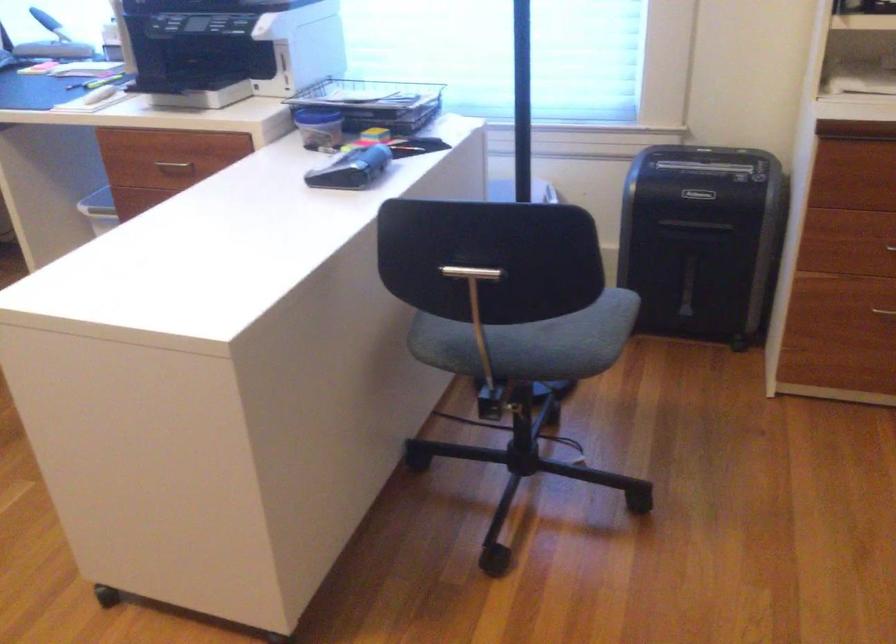
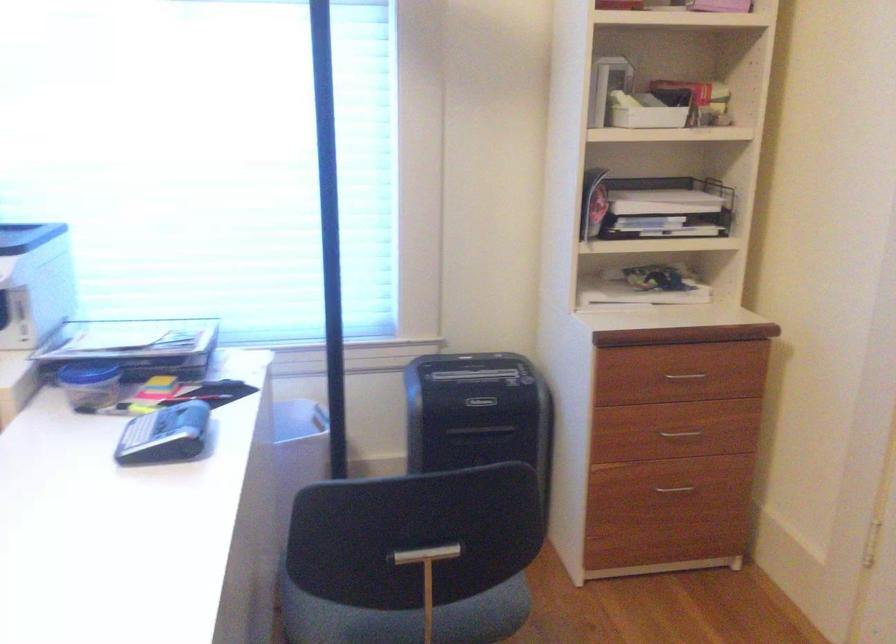
Question: The images are taken continuously from a first-person perspective. In which direction is your viewpoint rotating?

Choices:
 (A) Left
 (B) Right
 (C) Up
 (D) Down

Answer: (B)